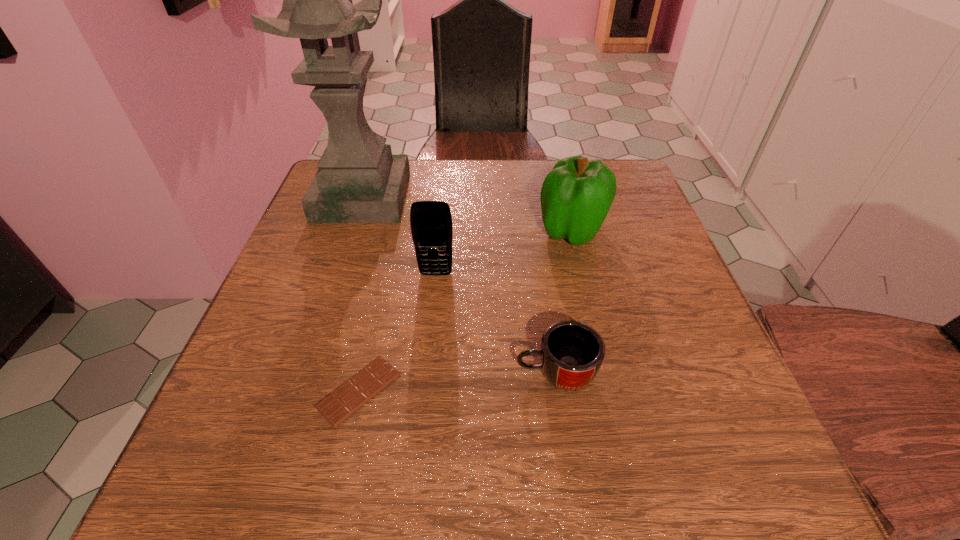
The width and height of the screenshot is (960, 540). Find the location of `vacant space that satisfies the following two spatial constraints: 1. on the front side of the bell pepper; 2. on the side of the mug with the handle`. vacant space that satisfies the following two spatial constraints: 1. on the front side of the bell pepper; 2. on the side of the mug with the handle is located at coordinates (606, 374).

Find the location of `free location that satisfies the following two spatial constraints: 1. at the front opening of the tallest object; 2. on the right side of the bell pepper`. free location that satisfies the following two spatial constraints: 1. at the front opening of the tallest object; 2. on the right side of the bell pepper is located at coordinates (351, 230).

Find the location of a particular element. The image size is (960, 540). vacant space that satisfies the following two spatial constraints: 1. at the front opening of the tallest object; 2. on the left side of the chocolate bar is located at coordinates (298, 390).